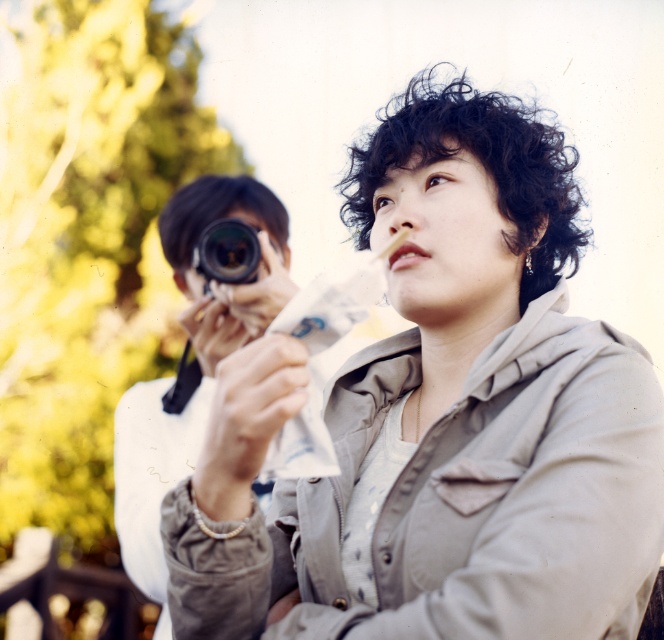
Which of these two, matte beige jacket at center or matte white camera at center, stands taller?

matte white camera at center

Is matte beige jacket at center above matte white camera at center?

Correct, matte beige jacket at center is located above matte white camera at center.

You are a GUI agent. You are given a task and a screenshot of the screen. Output one action in this format:
    pyautogui.click(x=<x>, y=<y>)
    Task: Click on the matte beige jacket at center
    This screenshot has height=640, width=664.
    Given the screenshot: What is the action you would take?
    pyautogui.click(x=442, y=417)

Measure the distance between matte white camera at center and black plastic camera at center.

They are 13.04 inches apart.

Is matte white camera at center to the right of black plastic camera at center from the viewer's perspective?

Incorrect, matte white camera at center is not on the right side of black plastic camera at center.

Consider the image. Who is more forward, (203, 333) or (234, 275)?

Positioned in front is point (203, 333).

The height and width of the screenshot is (640, 664). I want to click on matte white camera at center, so coord(191,364).

Looking at this image, does matte beige jacket at center appear under black plastic camera at center?

Correct, matte beige jacket at center is located below black plastic camera at center.

The height and width of the screenshot is (640, 664). What do you see at coordinates (442, 417) in the screenshot?
I see `matte beige jacket at center` at bounding box center [442, 417].

Identify the location of matte beige jacket at center. (442, 417).